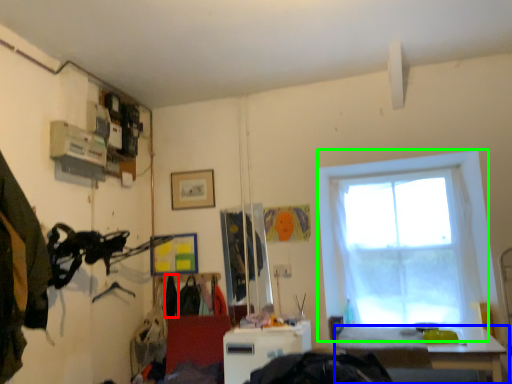
Question: Which object is the closest to the clothing (highlighted by a red box)? Choose among these: table (highlighted by a blue box) or window (highlighted by a green box).

Choices:
 (A) table
 (B) window

Answer: (A)